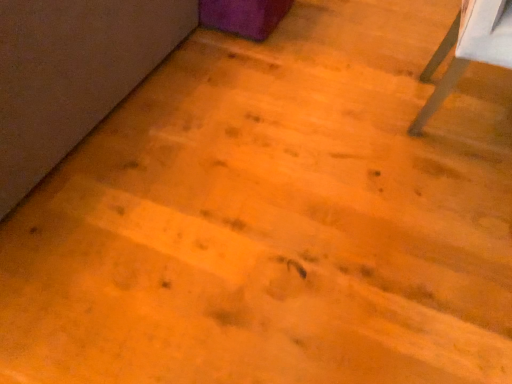
Where is `vacant space in front of wooden table at right`? vacant space in front of wooden table at right is located at coordinates pyautogui.click(x=439, y=185).